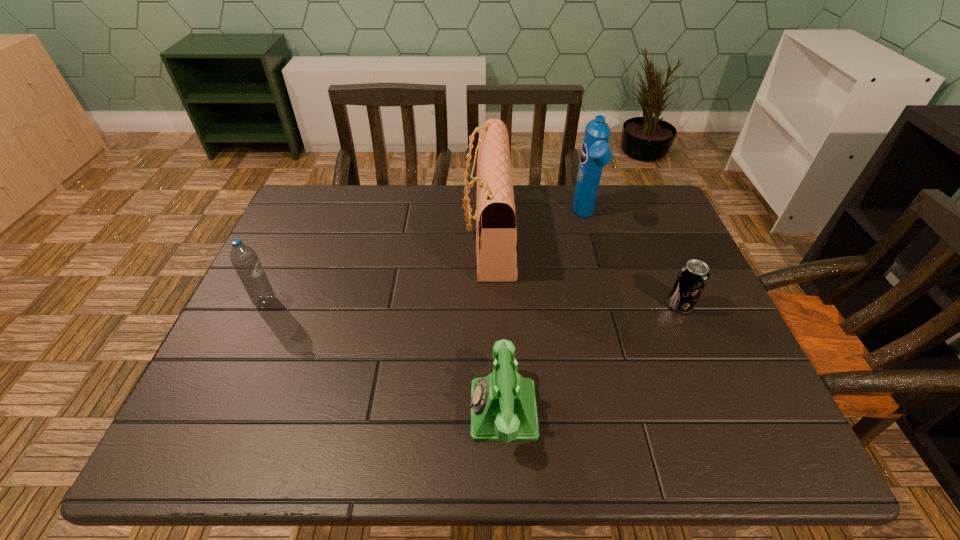
The height and width of the screenshot is (540, 960). I want to click on vacant space at the far edge of the desktop, so click(616, 227).

What are the coordinates of `vacant space at the near edge` in the screenshot? It's located at (576, 445).

In the image, there is a desktop. Where is `free space at the left edge`? The image size is (960, 540). free space at the left edge is located at coordinates (278, 327).

You are a GUI agent. You are given a task and a screenshot of the screen. Output one action in this format:
    pyautogui.click(x=<x>, y=<y>)
    Task: Click on the free space at the right edge of the desktop
    Image resolution: width=960 pixels, height=540 pixels.
    Given the screenshot: What is the action you would take?
    pyautogui.click(x=723, y=349)

This screenshot has height=540, width=960. In the image, there is a desktop. In order to click on vacant space at the far left corner in this screenshot , I will do `click(310, 228)`.

This screenshot has width=960, height=540. Find the location of `vacant space at the near left corner of the desktop`. vacant space at the near left corner of the desktop is located at coordinates (211, 428).

The image size is (960, 540). What are the coordinates of `vacant point at the far right corner` in the screenshot? It's located at (648, 198).

Where is `vacant point located between the second tallest object and the nearest object`? This screenshot has height=540, width=960. vacant point located between the second tallest object and the nearest object is located at coordinates (495, 321).

At what (x,y) coordinates should I click in order to perform the action: click on free point between the fourth shortest object and the third tallest object. Please return your answer as a coordinate pair (x, y). Looking at the image, I should click on (377, 267).

Where is `free space between the water bottle and the soda can`? The height and width of the screenshot is (540, 960). free space between the water bottle and the soda can is located at coordinates click(x=473, y=303).